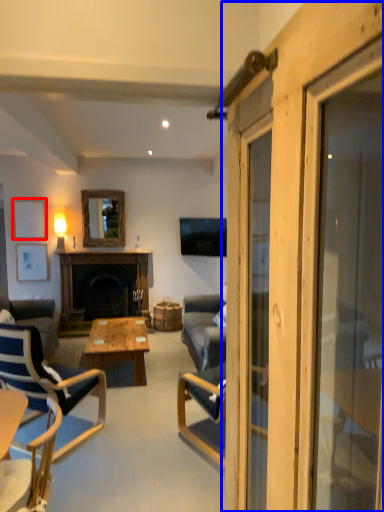
Question: Which point is further to the camera, picture frame (highlighted by a red box) or barn door (highlighted by a blue box)?

Choices:
 (A) picture frame
 (B) barn door

Answer: (A)